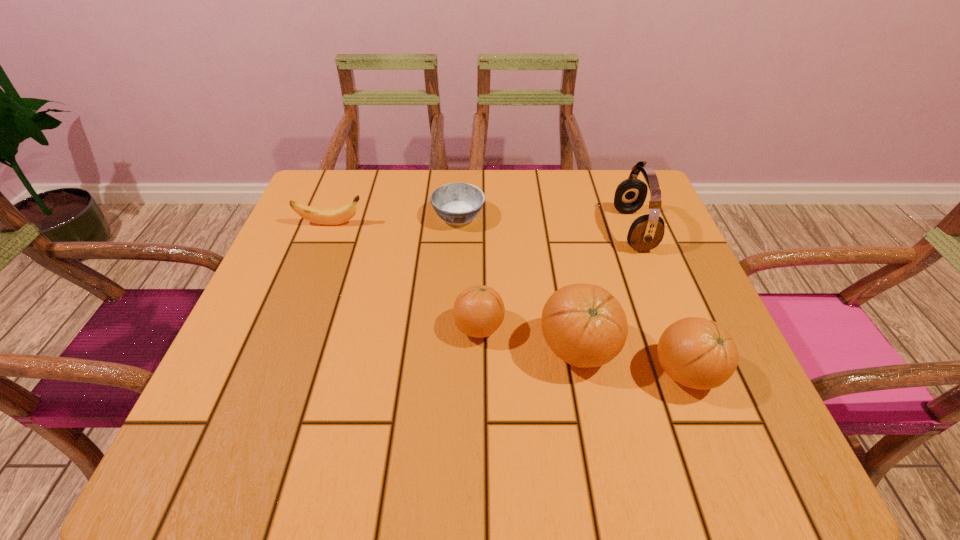
Locate an element on the screen. The height and width of the screenshot is (540, 960). the shortest orange is located at coordinates (479, 311).

Identify the location of the third object from right to left. (584, 325).

Where is `the second orange from left to right`? The width and height of the screenshot is (960, 540). the second orange from left to right is located at coordinates (584, 325).

This screenshot has height=540, width=960. I want to click on the rightmost orange, so click(698, 353).

This screenshot has height=540, width=960. In order to click on the third tallest object in this screenshot , I will do `click(698, 353)`.

This screenshot has height=540, width=960. What are the coordinates of `the shortest object` in the screenshot? It's located at (455, 203).

Find the location of `headset`. headset is located at coordinates (646, 232).

The width and height of the screenshot is (960, 540). I want to click on the fifth tallest object, so click(321, 216).

The image size is (960, 540). I want to click on the leftmost object, so click(x=321, y=216).

Where is `free region located on the back of the leftmost orange`? The width and height of the screenshot is (960, 540). free region located on the back of the leftmost orange is located at coordinates (479, 252).